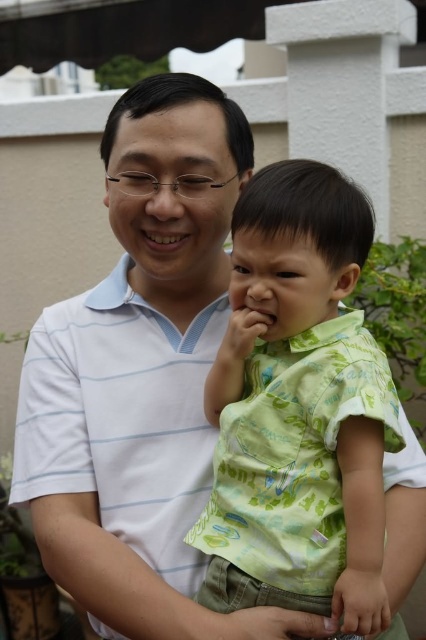
Question: Which of the following is the farthest from the observer?

Choices:
 (A) green printed shirt at center
 (B) white striped polo shirt at center

Answer: (B)

Question: Which of the following is the farthest from the observer?

Choices:
 (A) green printed shirt at center
 (B) white striped polo shirt at center

Answer: (B)

Question: Does green printed shirt at center have a larger size compared to white striped polo shirt at center?

Choices:
 (A) no
 (B) yes

Answer: (A)

Question: Can you confirm if green printed shirt at center is wider than white striped polo shirt at center?

Choices:
 (A) no
 (B) yes

Answer: (A)

Question: Where is green printed shirt at center located in relation to white striped polo shirt at center in the image?

Choices:
 (A) above
 (B) below

Answer: (A)